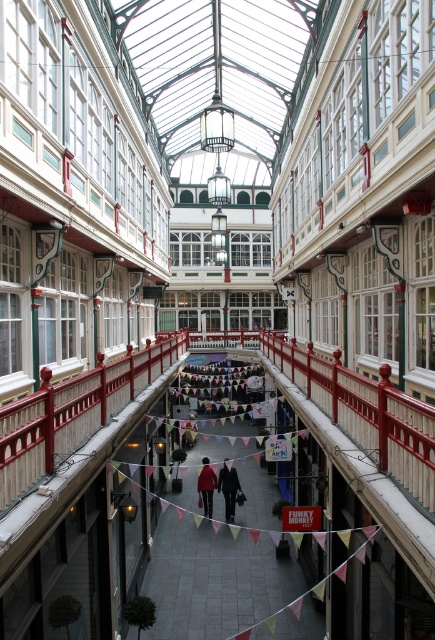
Question: Can you confirm if wooden railing at center is positioned to the left of matte red coat at center?

Choices:
 (A) yes
 (B) no

Answer: (A)

Question: Can you confirm if red painted metal railing at center is wider than dark gray fabric coat at center?

Choices:
 (A) yes
 (B) no

Answer: (A)

Question: Among these points, which one is farthest from the camera?

Choices:
 (A) (358, 410)
 (B) (46, 460)

Answer: (A)

Question: Estimate the real-world distances between objects in this image. Which object is closer to the red painted metal railing at center?

Choices:
 (A) matte red coat at center
 (B) dark gray fabric coat at center

Answer: (A)

Question: Can you confirm if dark gray fabric coat at center is positioned to the right of matte red coat at center?

Choices:
 (A) no
 (B) yes

Answer: (B)

Question: Which object appears closest to the camera in this image?

Choices:
 (A) matte red coat at center
 (B) wooden railing at center

Answer: (B)